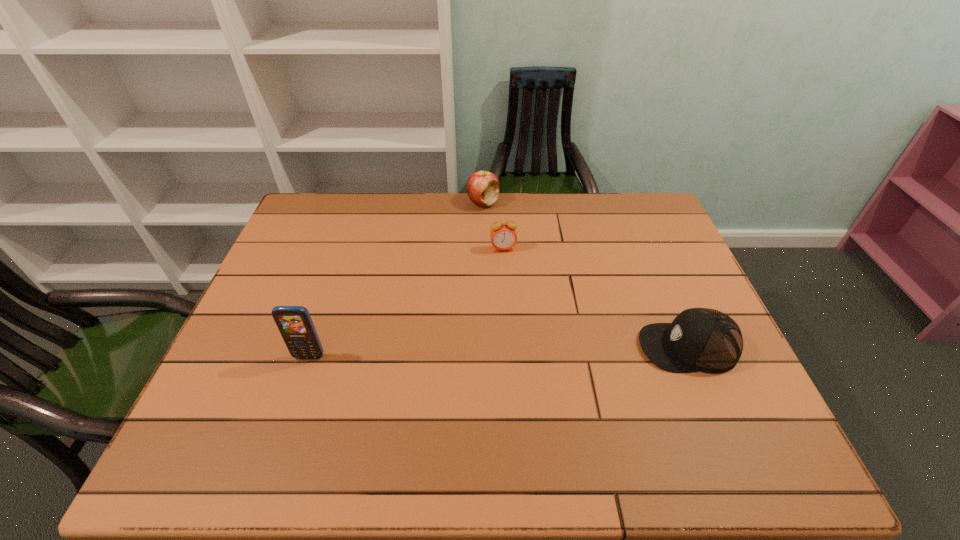
Identify the location of the tallest object. (295, 325).

The height and width of the screenshot is (540, 960). What are the coordinates of `the leftmost object` in the screenshot? It's located at (295, 325).

Identify the location of the rightmost object. (699, 339).

Identify the location of the third nearest object. The image size is (960, 540). (503, 236).

The height and width of the screenshot is (540, 960). I want to click on the farthest object, so click(x=482, y=187).

Identify the location of free space located on the screen of the leftmost object. Image resolution: width=960 pixels, height=540 pixels. (301, 379).

This screenshot has width=960, height=540. In order to click on blank space located on the front-facing side of the rightmost object in this screenshot , I will do pyautogui.click(x=526, y=347).

I want to click on vacant area situated on the front-facing side of the rightmost object, so click(570, 347).

Locate an element on the screen. The height and width of the screenshot is (540, 960). free region located on the front-facing side of the rightmost object is located at coordinates (614, 347).

Locate an element on the screen. The width and height of the screenshot is (960, 540). vacant space located 0.220m on the face of the alarm clock is located at coordinates (515, 307).